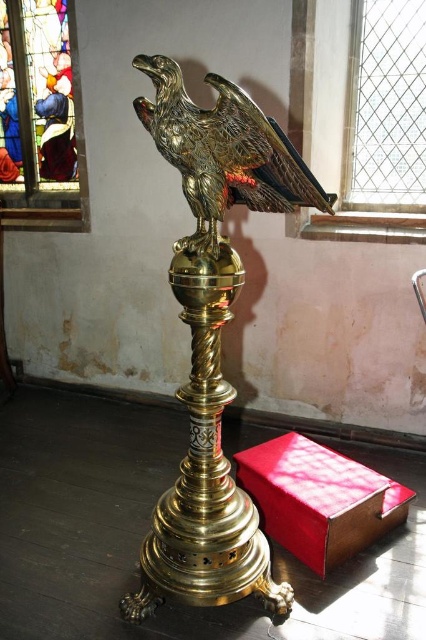
You are standing in front of the golden lectern in the image. Where is the gold polished eagle at center located in terms of its position relative to the lectern?

The gold polished eagle at center is positioned at the center of the lectern, specifically at coordinates approximately 0.527 on the horizontal axis and 0.500 on the vertical axis, which places it centrally on the lectern.

Looking at this image, you are an art student analyzing the spatial arrangement of the scene. You notice the gold polished eagle at center and the stained glass at upper left. Which object appears closer to you in the image?

The gold polished eagle at center is closer to the viewer than the stained glass at upper left.

You are an art conservator examining two eagles on a lectern. The gold polished eagle at center and the shiny gold eagle at center. Which one is bigger?

The gold polished eagle at center is larger in size than the shiny gold eagle at center.